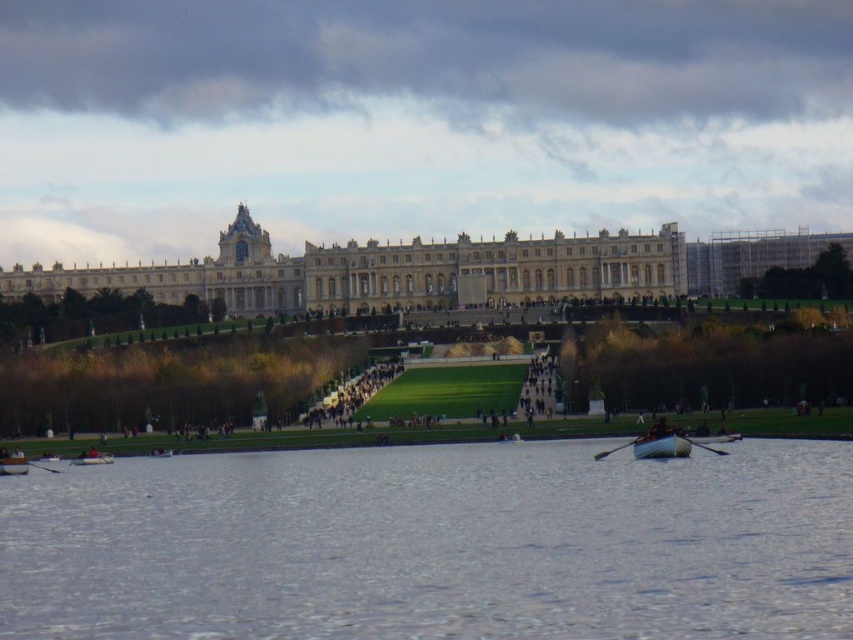
In the scene shown: Is wooden rowboat at lower center shorter than white wood paddle at lower left?

No.

Where is `wooden rowboat at lower center`? This screenshot has height=640, width=853. wooden rowboat at lower center is located at coordinates (660, 445).

Locate an element on the screen. wooden rowboat at lower center is located at coordinates (660, 445).

Does white plastic boat at lower left have a smaller size compared to brown leather jacket at center?

Yes, white plastic boat at lower left is smaller than brown leather jacket at center.

Is point (96, 460) in front of point (662, 420)?

No, it is behind (662, 420).

What are the coordinates of `white plastic boat at lower left` in the screenshot? It's located at coord(91,458).

Consider the image. Does black rubber paddle at lower right have a lesser width compared to white wood paddle at lower left?

Indeed, black rubber paddle at lower right has a lesser width compared to white wood paddle at lower left.

Who is shorter, black rubber paddle at lower right or white wood paddle at lower left?

black rubber paddle at lower right is shorter.

Is point (706, 444) closer to camera compared to point (53, 467)?

Yes, point (706, 444) is closer to viewer.

You are a GUI agent. You are given a task and a screenshot of the screen. Output one action in this format:
    pyautogui.click(x=<x>, y=<y>)
    Task: Click on the black rubber paddle at lower right
    The image size is (853, 640).
    Given the screenshot: What is the action you would take?
    pyautogui.click(x=704, y=445)